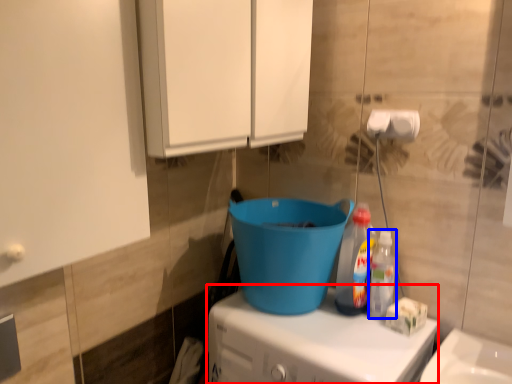
Question: Which point is closer to the camera, appliance (highlighted by a red box) or bottle (highlighted by a blue box)?

Choices:
 (A) appliance
 (B) bottle

Answer: (A)